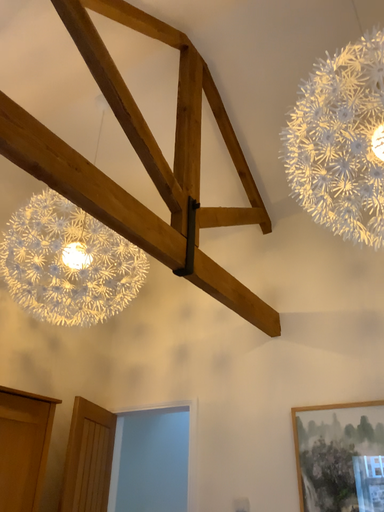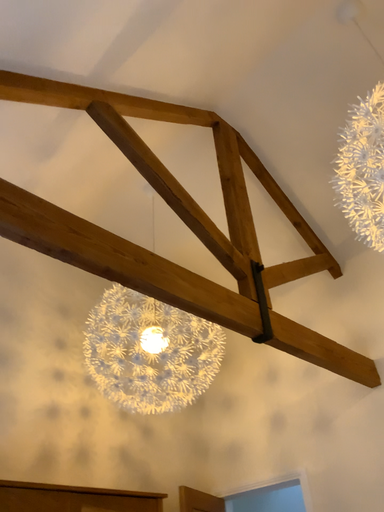
Question: How did the camera likely rotate when shooting the video?

Choices:
 (A) rotated upward
 (B) rotated downward

Answer: (A)